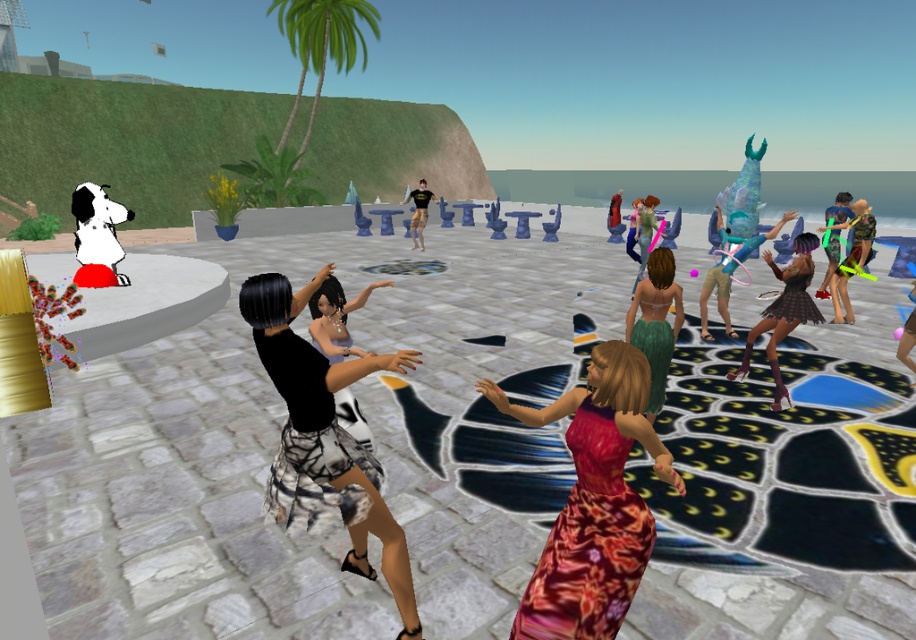
Does black matte skirt at center appear on the right side of plaid skirt at center?

No, black matte skirt at center is not to the right of plaid skirt at center.

Describe the element at coordinates (325, 438) in the screenshot. This screenshot has height=640, width=916. I see `black matte skirt at center` at that location.

Find the location of a particular element. This screenshot has height=640, width=916. black matte skirt at center is located at coordinates (325, 438).

Does floral satin dress at center have a lesser height compared to green textured skirt at center?

Yes.

Can you confirm if floral satin dress at center is smaller than green textured skirt at center?

Indeed, floral satin dress at center has a smaller size compared to green textured skirt at center.

Between point (511, 625) and point (644, 284), which one is positioned in front?

Positioned in front is point (511, 625).

Image resolution: width=916 pixels, height=640 pixels. I want to click on floral satin dress at center, so click(x=589, y=540).

Which is above, teal fabric dress at center or green satin dress at center?

Positioned higher is teal fabric dress at center.

Does teal fabric dress at center appear on the right side of green satin dress at center?

Correct, you'll find teal fabric dress at center to the right of green satin dress at center.

What do you see at coordinates (729, 268) in the screenshot? I see `teal fabric dress at center` at bounding box center [729, 268].

Locate an element on the screen. The width and height of the screenshot is (916, 640). teal fabric dress at center is located at coordinates (729, 268).